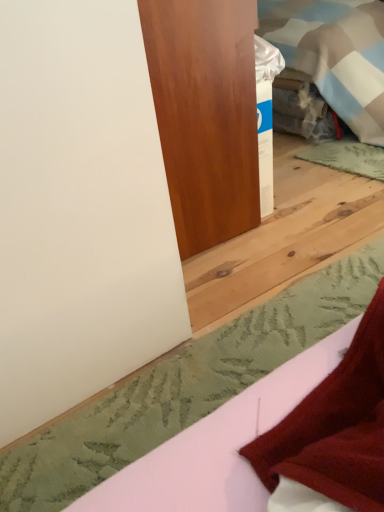
Describe the element at coordinates (274, 437) in the screenshot. I see `white matte sheet at lower right` at that location.

I want to click on white matte sheet at lower right, so click(x=274, y=437).

The image size is (384, 512). What do you see at coordinates (205, 114) in the screenshot?
I see `satin wood door at upper center` at bounding box center [205, 114].

Where is `satin wood door at upper center`? The width and height of the screenshot is (384, 512). satin wood door at upper center is located at coordinates (205, 114).

The width and height of the screenshot is (384, 512). In order to click on white matte sheet at lower right in this screenshot , I will do `click(274, 437)`.

Is satin wood door at upper center to the right of white matte sheet at lower right from the viewer's perspective?

No, satin wood door at upper center is not to the right of white matte sheet at lower right.

Does satin wood door at upper center come in front of white matte sheet at lower right?

No, the depth of satin wood door at upper center is greater than that of white matte sheet at lower right.

Does point (169, 19) come closer to viewer compared to point (323, 364)?

No, (169, 19) is behind (323, 364).

From the image's perspective, is satin wood door at upper center above or below white matte sheet at lower right?

satin wood door at upper center is above white matte sheet at lower right.

From a real-world perspective, which object stands above the other?

satin wood door at upper center, from a real-world perspective.

Can you confirm if satin wood door at upper center is thinner than white matte sheet at lower right?

Yes, satin wood door at upper center is thinner than white matte sheet at lower right.

Can you confirm if satin wood door at upper center is taller than white matte sheet at lower right?

Yes.

Does satin wood door at upper center have a larger size compared to white matte sheet at lower right?

Indeed, satin wood door at upper center has a larger size compared to white matte sheet at lower right.

Does satin wood door at upper center contain white matte sheet at lower right?

No, white matte sheet at lower right is not surrounded by satin wood door at upper center.

Are satin wood door at upper center and white matte sheet at lower right far apart?

satin wood door at upper center is near white matte sheet at lower right, not far away.

Is satin wood door at upper center aimed at white matte sheet at lower right?

No, satin wood door at upper center does not turn towards white matte sheet at lower right.

In order to click on furniture behind the white matte sheet at lower right in this screenshot , I will do `click(205, 114)`.

Which object is positioned more to the left, white matte sheet at lower right or satin wood door at upper center?

satin wood door at upper center is more to the left.

Relative to satin wood door at upper center, is white matte sheet at lower right in front or behind?

Visually, white matte sheet at lower right is located in front of satin wood door at upper center.

Does point (232, 495) come closer to viewer compared to point (145, 24)?

Yes, it is.

In the scene shown: From the image's perspective, is white matte sheet at lower right above satin wood door at upper center?

No.

From a real-world perspective, between white matte sheet at lower right and satin wood door at upper center, who is vertically lower?

white matte sheet at lower right is physically lower.

Consider the image. Considering the sizes of objects white matte sheet at lower right and satin wood door at upper center in the image provided, who is thinner, white matte sheet at lower right or satin wood door at upper center?

With smaller width is satin wood door at upper center.

From their relative heights in the image, would you say white matte sheet at lower right is taller or shorter than satin wood door at upper center?

Clearly, white matte sheet at lower right is shorter compared to satin wood door at upper center.

Is white matte sheet at lower right bigger or smaller than satin wood door at upper center?

white matte sheet at lower right is smaller than satin wood door at upper center.

Can we say white matte sheet at lower right lies outside satin wood door at upper center?

white matte sheet at lower right lies outside satin wood door at upper center's area.

Is white matte sheet at lower right directly adjacent to satin wood door at upper center?

No, white matte sheet at lower right is not in contact with satin wood door at upper center.

Is white matte sheet at lower right facing away from satin wood door at upper center?

No, white matte sheet at lower right's orientation is not away from satin wood door at upper center.

How many degrees apart are the facing directions of white matte sheet at lower right and satin wood door at upper center?

They differ by 2.41 degrees in their facing directions.

This screenshot has height=512, width=384. Find the location of `sheet located in front of the satin wood door at upper center`. sheet located in front of the satin wood door at upper center is located at coordinates (274, 437).

This screenshot has width=384, height=512. What are the coordinates of `furniture that is behind the white matte sheet at lower right` in the screenshot? It's located at (205, 114).

Where is `furniture above the white matte sheet at lower right (from the image's perspective)`? This screenshot has height=512, width=384. furniture above the white matte sheet at lower right (from the image's perspective) is located at coordinates (205, 114).